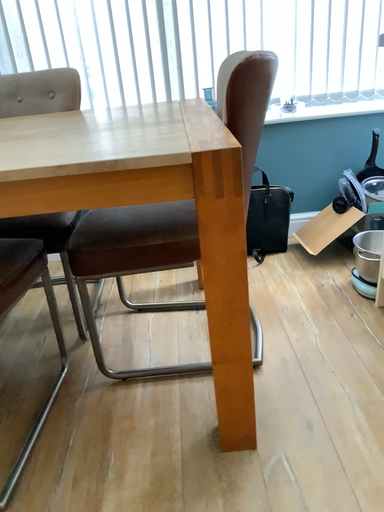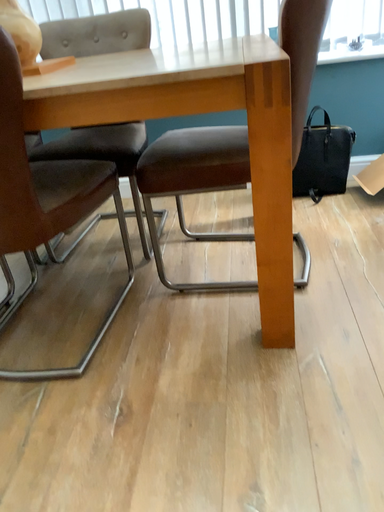
Question: How did the camera likely rotate when shooting the video?

Choices:
 (A) rotated left
 (B) rotated right

Answer: (A)